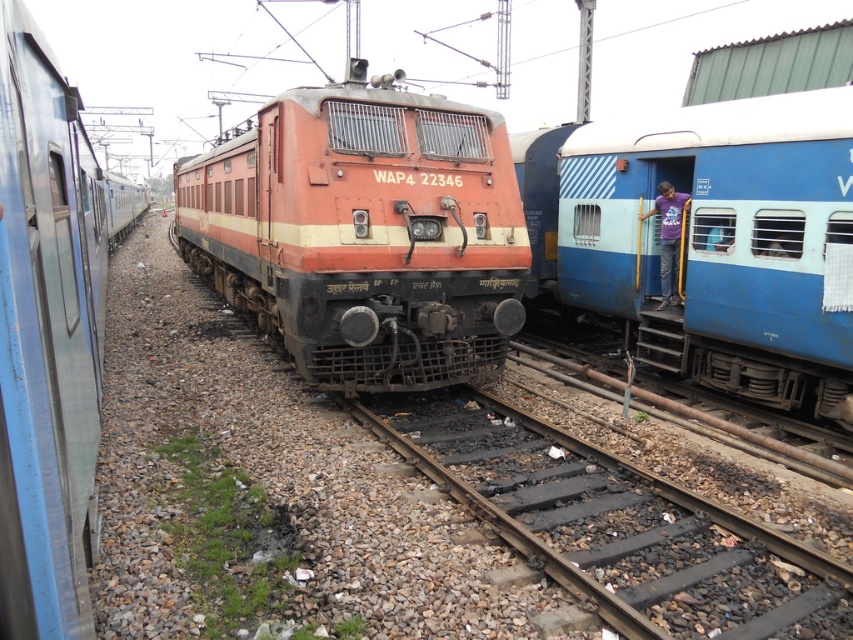
Question: Which of these objects is positioned closest to the rusty metal train track at center?

Choices:
 (A) matte blue train at center
 (B) blue metallic passenger train at right
 (C) orange matte train at center

Answer: (B)

Question: Can you confirm if orange matte train at center is positioned above rusty metal train track at center?

Choices:
 (A) no
 (B) yes

Answer: (B)

Question: Is blue metallic passenger train at right above matte blue train at center?

Choices:
 (A) no
 (B) yes

Answer: (A)

Question: Which point is closer to the camera?

Choices:
 (A) (422, 102)
 (B) (74, 128)
 (C) (601, 144)

Answer: (B)

Question: Is orange matte train at center to the left of blue metallic passenger train at right from the viewer's perspective?

Choices:
 (A) no
 (B) yes

Answer: (B)

Question: Estimate the real-world distances between objects in this image. Which object is farther from the blue metallic passenger train at right?

Choices:
 (A) matte blue train at center
 (B) rusty metal train track at center
 (C) orange matte train at center

Answer: (C)